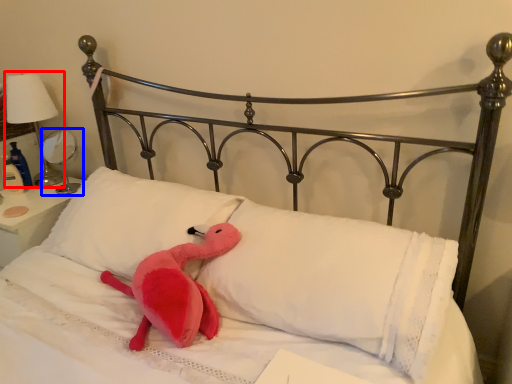
Question: Which of the following is the closest to the observer, table lamp (highlighted by a red box) or table lamp (highlighted by a blue box)?

Choices:
 (A) table lamp
 (B) table lamp

Answer: (A)